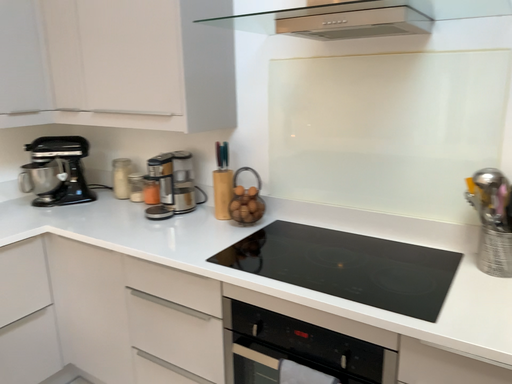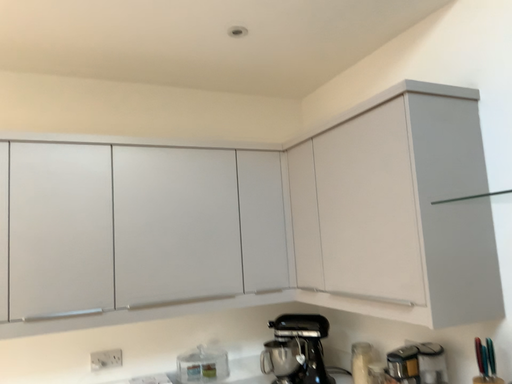
Question: How did the camera likely rotate when shooting the video?

Choices:
 (A) rotated right
 (B) rotated left

Answer: (B)